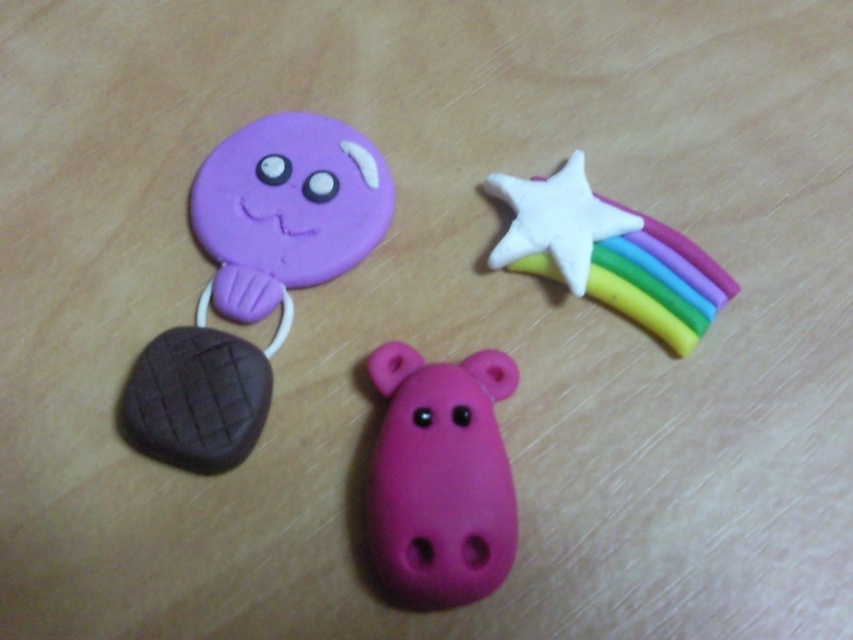
Question: Can you confirm if matte purple cookie at upper left is thinner than pastel rainbow star at upper right?

Choices:
 (A) no
 (B) yes

Answer: (A)

Question: Based on their relative distances, which object is nearer to the white matte star at upper right?

Choices:
 (A) matte purple cookie at upper left
 (B) pink matte hippo at center
 (C) pastel rainbow star at upper right

Answer: (C)

Question: Among these objects, which one is nearest to the camera?

Choices:
 (A) pastel rainbow star at upper right
 (B) white matte star at upper right
 (C) matte purple cookie at upper left

Answer: (C)

Question: Based on their relative distances, which object is nearer to the matte purple cookie at upper left?

Choices:
 (A) white matte star at upper right
 (B) pink matte hippo at center
 (C) pastel rainbow star at upper right

Answer: (B)

Question: Does pink matte hippo at center have a larger size compared to white matte star at upper right?

Choices:
 (A) no
 (B) yes

Answer: (B)

Question: Does pink matte hippo at center have a lesser width compared to white matte star at upper right?

Choices:
 (A) no
 (B) yes

Answer: (B)